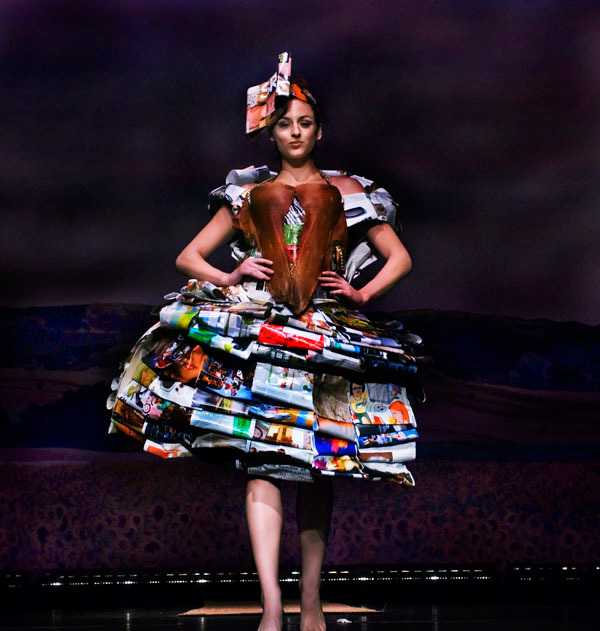
Where is `white led lights`? This screenshot has height=631, width=600. white led lights is located at coordinates (411, 580).